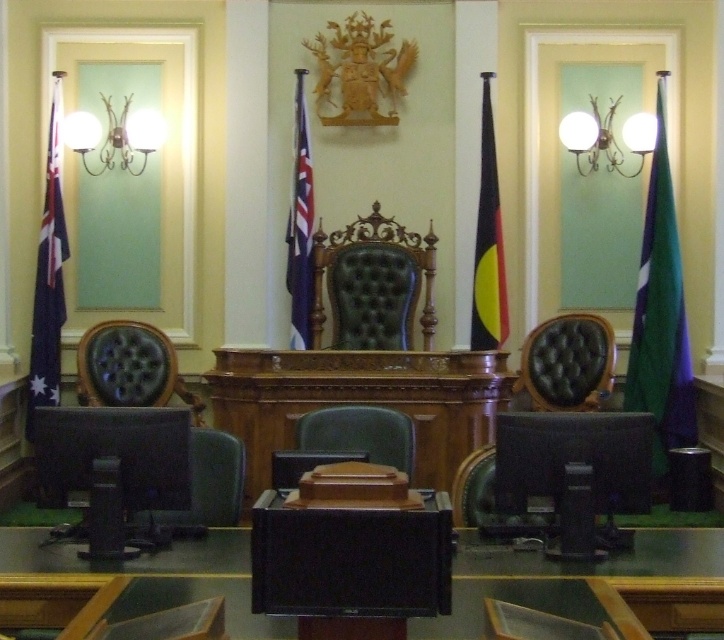
You are a maintenance worker needing to replace a light fixture. You are standing at the smooth black table at center and need to reach the white glass sconce at upper center. Can you safely reach the sconce without a ladder if your maximum reach height is 1.8 meters?

The distance between the smooth black table at center and the white glass sconce at upper center is 4.33 meters. Since this distance exceeds your maximum reach height of 1.8 meters, you cannot safely reach the sconce without a ladder.

You are an interior designer planning to place a new table in the legislative chamber. The table must be placed between the green fabric flag at right and the green leather chair at center. Given their sizes, which object should you consider for spacing adjustments to ensure the table fits properly?

The green fabric flag at right has a larger size compared to the green leather chair at center, so you should adjust spacing around the green fabric flag at right to accommodate its size when placing the new table between them.

You are an interior designer planning to hang a new painting above the green leather chair at center. Considering the green fabric flag at right, which is taller than the chair, should the painting be placed higher or lower than the flag?

The green fabric flag at right has a greater height compared to the green leather chair at center, so the painting should be placed lower than the flag to maintain visual balance.